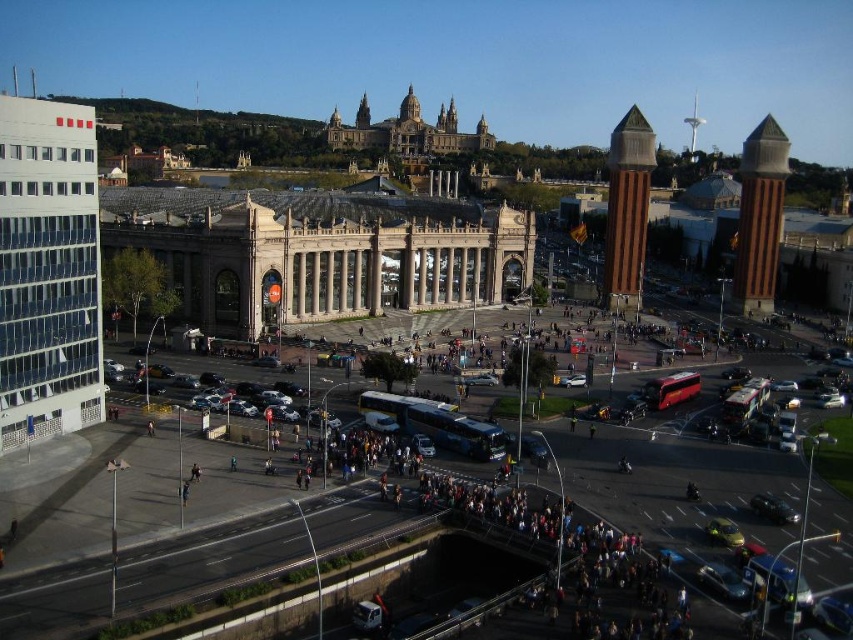
What is located at the coordinate point (759, 218) in the image?

The brown stone tower at right is located at point (759, 218).

You are standing in the plaza and want to take a photo of both point (772,132) and point (631,168) in the image. Which point should you move towards to get both in the frame without zooming?

You should move towards point (772,132) because it is closer to you than point (631,168), allowing both points to be captured in the frame without zooming.